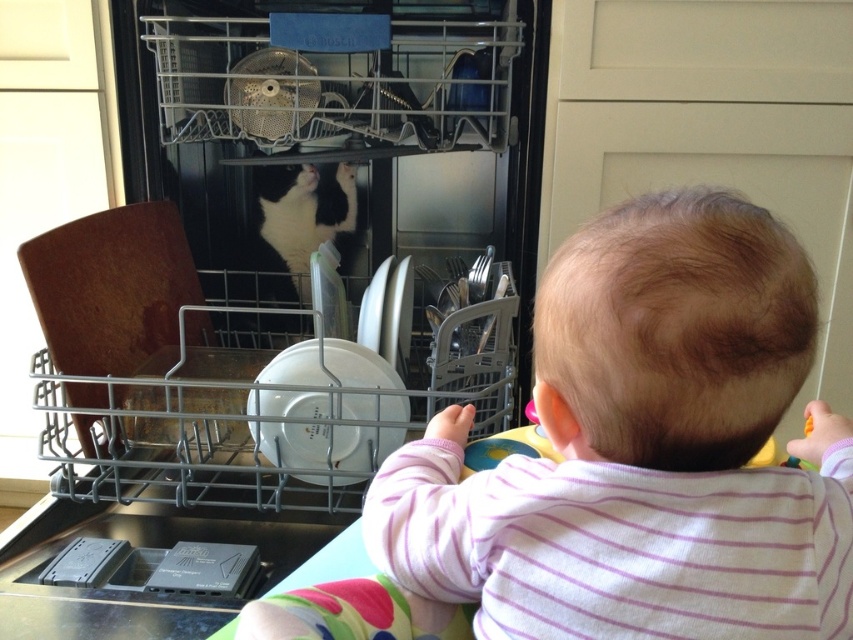
Question: Can you confirm if matte black dishwasher at center is thinner than smooth pink shirt at center?

Choices:
 (A) yes
 (B) no

Answer: (B)

Question: From the image, what is the correct spatial relationship of matte black dishwasher at center in relation to smooth pink shirt at center?

Choices:
 (A) left
 (B) right

Answer: (A)

Question: Which of these objects is positioned closest to the black and white fur at center?

Choices:
 (A) matte black dishwasher at center
 (B) smooth pink shirt at center

Answer: (A)

Question: Which point is farther from the camera taking this photo?

Choices:
 (A) (294, 282)
 (B) (618, 360)

Answer: (A)

Question: Can you confirm if matte black dishwasher at center is thinner than smooth pink shirt at center?

Choices:
 (A) no
 (B) yes

Answer: (A)

Question: Considering the real-world distances, which object is farthest from the black and white fur at center?

Choices:
 (A) smooth pink shirt at center
 (B) matte black dishwasher at center

Answer: (A)